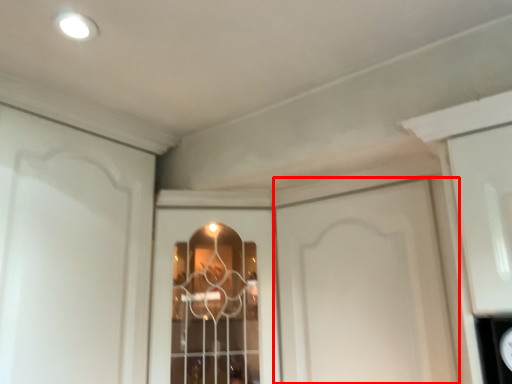
Question: From the image, what is the correct spatial relationship of door (annotated by the red box) in relation to window?

Choices:
 (A) left
 (B) right

Answer: (B)